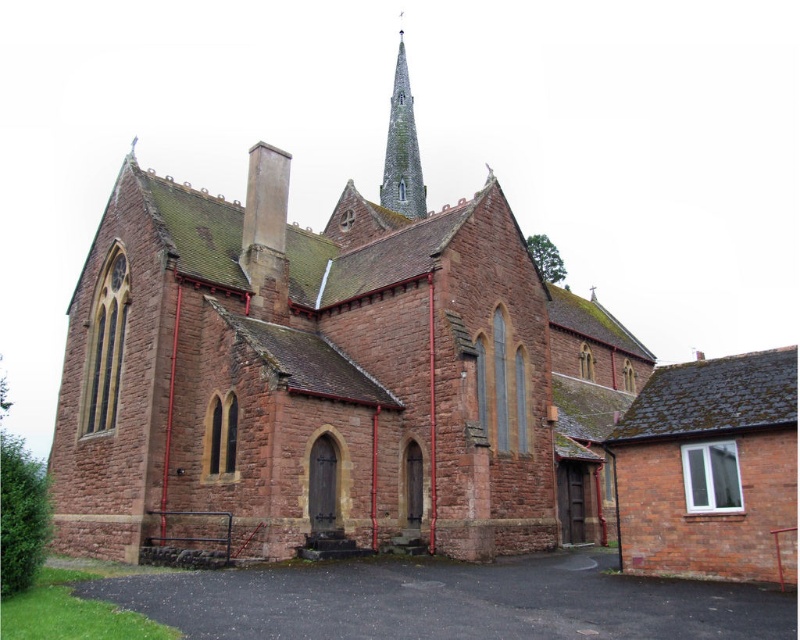
Question: Which of the following is the closest to the observer?

Choices:
 (A) gray stone spire at upper center
 (B) brown stone chapel at center

Answer: (B)

Question: Is brown stone chapel at center wider than gray stone spire at upper center?

Choices:
 (A) yes
 (B) no

Answer: (A)

Question: Which of the following is the closest to the observer?

Choices:
 (A) brown stone chapel at center
 (B) gray stone spire at upper center

Answer: (A)

Question: Which point is farther to the camera?

Choices:
 (A) gray stone spire at upper center
 (B) brown stone chapel at center

Answer: (A)

Question: Can you confirm if brown stone chapel at center is bigger than gray stone spire at upper center?

Choices:
 (A) yes
 (B) no

Answer: (A)

Question: Is brown stone chapel at center wider than gray stone spire at upper center?

Choices:
 (A) no
 (B) yes

Answer: (B)